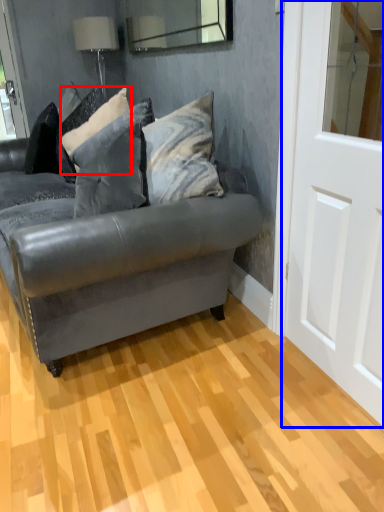
Question: Which point is further to the camera, pillow (highlighted by a red box) or screen door (highlighted by a blue box)?

Choices:
 (A) pillow
 (B) screen door

Answer: (A)